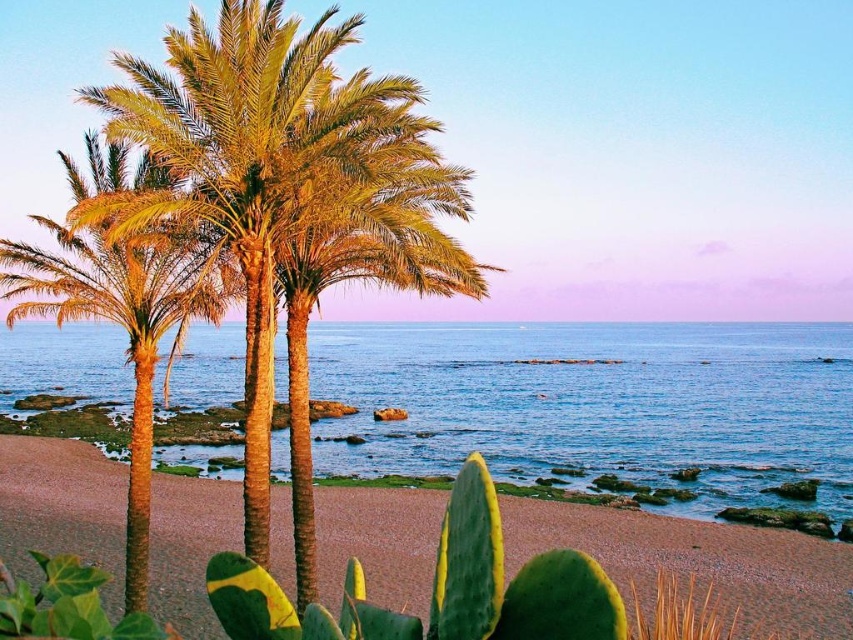
Is blue water at center thinner than green leafy palm trees at center?

Incorrect, blue water at center's width is not less than green leafy palm trees at center's.

Does point (329, 436) come farther from viewer compared to point (248, 544)?

Yes.

Which is behind, point (421, 369) or point (234, 35)?

The point (421, 369) is behind.

Find the location of a particular element. The width and height of the screenshot is (853, 640). blue water at center is located at coordinates (598, 404).

Which is more to the left, green leafy palm trees at center or brown sandy beach at center?

From the viewer's perspective, brown sandy beach at center appears more on the left side.

Is point (263, 80) positioned after point (845, 602)?

That is False.

The image size is (853, 640). What are the coordinates of `green leafy palm trees at center` in the screenshot? It's located at (271, 168).

Is blue water at center to the right of brown sandy beach at center from the viewer's perspective?

Yes, blue water at center is to the right of brown sandy beach at center.

Does blue water at center have a greater width compared to brown sandy beach at center?

Yes.

Does point (503, 429) come behind point (122, 522)?

Yes, point (503, 429) is behind point (122, 522).

The image size is (853, 640). In order to click on blue water at center in this screenshot , I will do `click(598, 404)`.